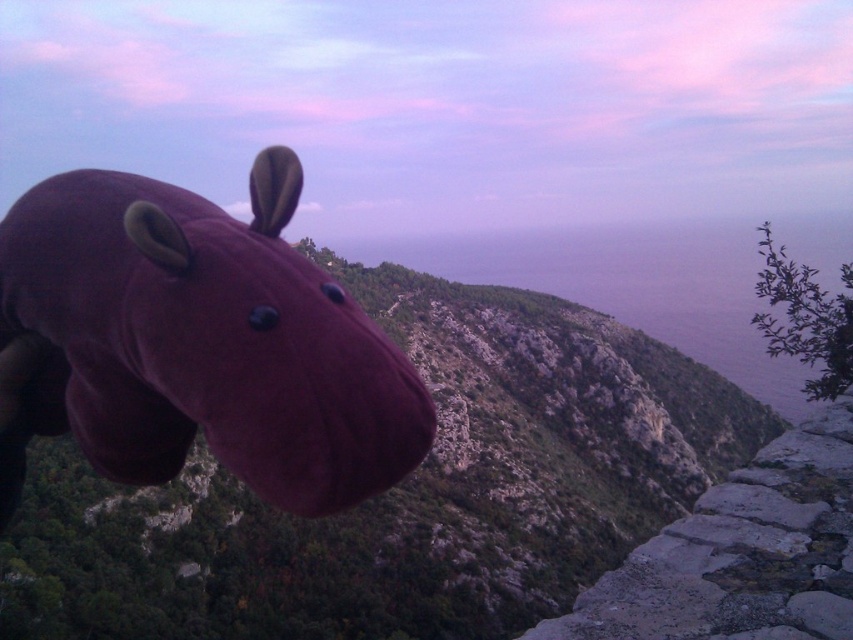
Question: Estimate the real-world distances between objects in this image. Which object is closer to the gray stone cliff at lower right?

Choices:
 (A) purple plush hippo at left
 (B) velvet purple hippo at left

Answer: (B)

Question: Can you confirm if purple plush hippo at left is thinner than velvet purple hippo at left?

Choices:
 (A) yes
 (B) no

Answer: (B)

Question: Is purple plush hippo at left below velvet purple hippo at left?

Choices:
 (A) no
 (B) yes

Answer: (B)

Question: Which object is closer to the camera taking this photo?

Choices:
 (A) purple plush hippo at left
 (B) velvet purple hippo at left
 (C) gray stone cliff at lower right

Answer: (B)

Question: Among these objects, which one is farthest from the camera?

Choices:
 (A) purple plush hippo at left
 (B) gray stone cliff at lower right
 (C) velvet purple hippo at left

Answer: (A)

Question: Considering the relative positions of velvet purple hippo at left and gray stone cliff at lower right in the image provided, where is velvet purple hippo at left located with respect to gray stone cliff at lower right?

Choices:
 (A) above
 (B) below

Answer: (A)